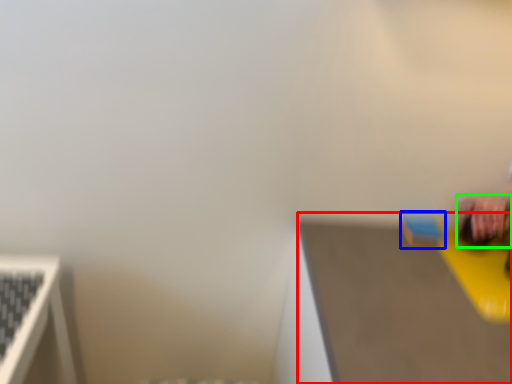
Question: Which object is the closest to the table top (highlighted by a red box)? Choose among these: toy (highlighted by a blue box) or toy (highlighted by a green box).

Choices:
 (A) toy
 (B) toy

Answer: (A)